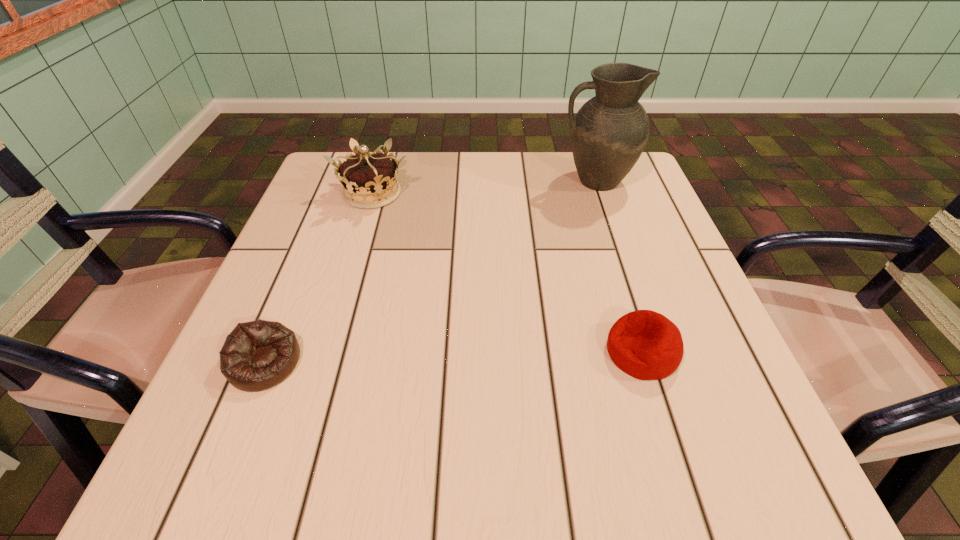
The width and height of the screenshot is (960, 540). I want to click on the tallest object, so click(610, 131).

Find the location of a particular element. Image resolution: width=960 pixels, height=540 pixels. crown is located at coordinates pos(369,180).

Where is `the third tallest object`? This screenshot has height=540, width=960. the third tallest object is located at coordinates (646, 345).

The width and height of the screenshot is (960, 540). What are the coordinates of `the right beanbag` in the screenshot? It's located at (646, 345).

You are a GUI agent. You are given a task and a screenshot of the screen. Output one action in this format:
    pyautogui.click(x=<x>, y=<y>)
    Task: Click on the shortest object
    This screenshot has width=960, height=540.
    Given the screenshot: What is the action you would take?
    pyautogui.click(x=257, y=355)

The image size is (960, 540). Find the location of `the shorter beanbag`. the shorter beanbag is located at coordinates (257, 355).

Where is `free space located on the side of the pitcher with the handle`? The width and height of the screenshot is (960, 540). free space located on the side of the pitcher with the handle is located at coordinates (403, 181).

Where is `blank area located on the side of the pitcher with the handle`? blank area located on the side of the pitcher with the handle is located at coordinates (435, 181).

This screenshot has width=960, height=540. Find the location of `vacant space situated 0.180m on the side of the pitcher with the handle`. vacant space situated 0.180m on the side of the pitcher with the handle is located at coordinates (487, 181).

At what (x,y) coordinates should I click in order to perform the action: click on vacant space located on the front of the second tallest object. Please return your answer as a coordinate pair (x, y). The width and height of the screenshot is (960, 540). Looking at the image, I should click on (327, 341).